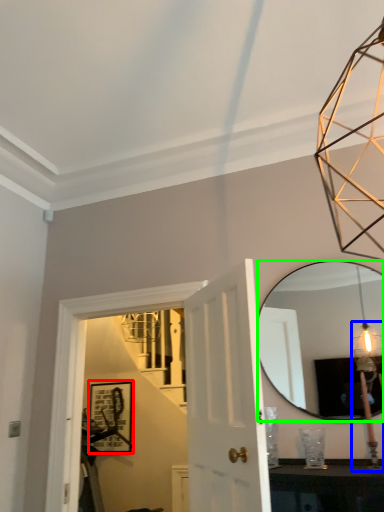
Question: Which object is the farthest from picture frame (highlighted by a red box)? Choose among these: light fixture (highlighted by a blue box) or mirror (highlighted by a green box).

Choices:
 (A) light fixture
 (B) mirror

Answer: (A)